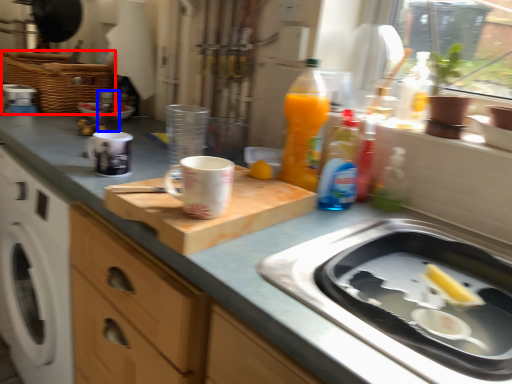
Question: Which object is further to the camera taking this photo, basket (highlighted by a red box) or bottle (highlighted by a blue box)?

Choices:
 (A) basket
 (B) bottle

Answer: (A)